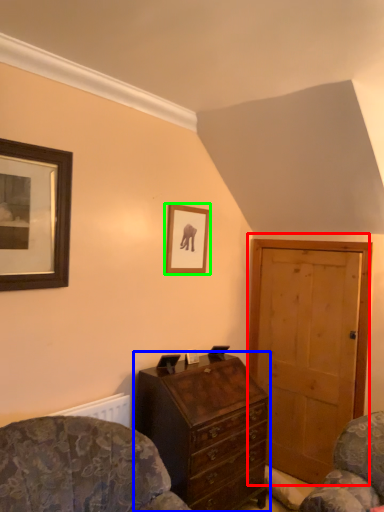
Question: Which is farther away from door (highlighted by a red box)? chest of drawers (highlighted by a blue box) or picture frame (highlighted by a green box)?

Choices:
 (A) chest of drawers
 (B) picture frame

Answer: (B)